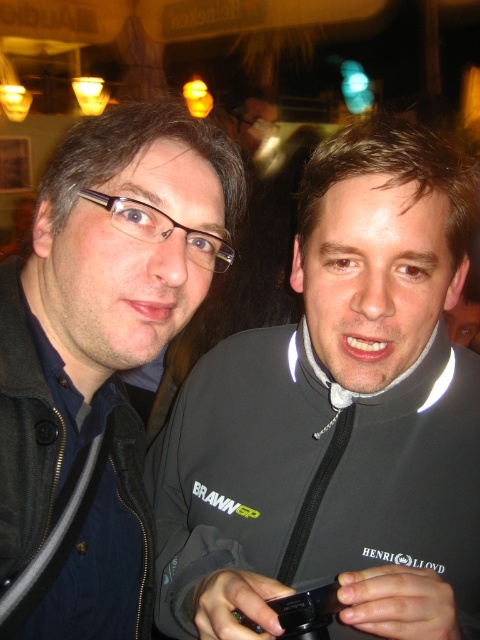
Question: Can you confirm if black matte jacket at center is smaller than matte black jacket at left?

Choices:
 (A) no
 (B) yes

Answer: (A)

Question: Which point appears closest to the camera in this image?

Choices:
 (A) (468, 586)
 (B) (117, 500)

Answer: (A)

Question: Considering the real-world distances, which object is closest to the matte black jacket at left?

Choices:
 (A) black plastic smartphone at center
 (B) black matte jacket at center

Answer: (B)

Question: Is black matte jacket at center above matte black jacket at left?

Choices:
 (A) yes
 (B) no

Answer: (B)

Question: Is black matte jacket at center above black plastic smartphone at center?

Choices:
 (A) no
 (B) yes

Answer: (B)

Question: Among these points, which one is nearest to the camera?

Choices:
 (A) (40, 451)
 (B) (310, 620)
 (C) (219, 429)

Answer: (B)